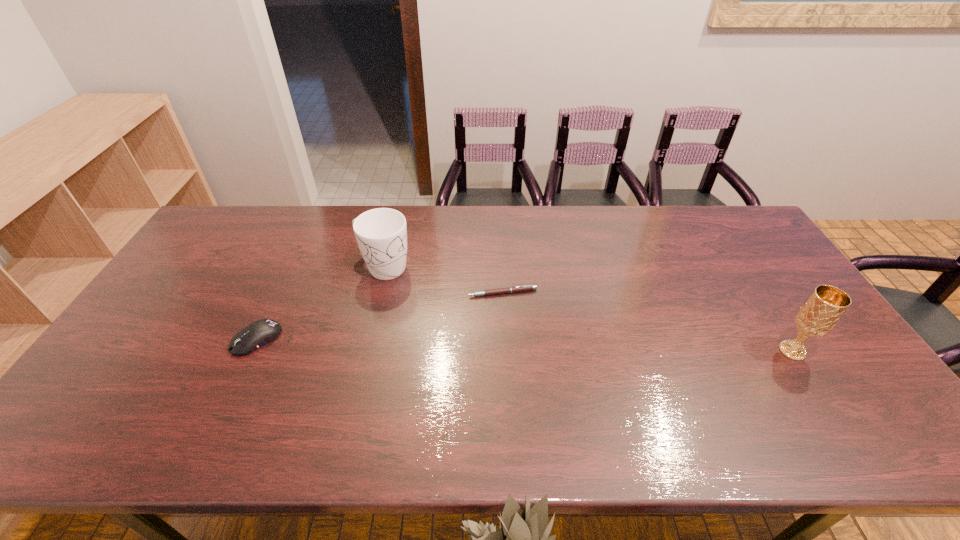
Identify the location of vacant area that lies between the chalice and the computer equipment. (524, 345).

Identify the location of object that is the closest to the second object from right to left. [381, 234].

Image resolution: width=960 pixels, height=540 pixels. I want to click on object that is the closest one to the third object from left to right, so click(381, 234).

Locate an element on the screen. free spot that satisfies the following two spatial constraints: 1. on the front side of the second object from right to left; 2. on the left side of the third object from right to left is located at coordinates (377, 293).

At what (x,y) coordinates should I click in order to perform the action: click on free spot that satisfies the following two spatial constraints: 1. on the front side of the farthest object; 2. on the right side of the rightmost object. Please return your answer as a coordinate pair (x, y). Looking at the image, I should click on (364, 351).

Locate an element on the screen. Image resolution: width=960 pixels, height=540 pixels. vacant space that satisfies the following two spatial constraints: 1. on the front side of the third object from left to right; 2. on the left side of the rightmost object is located at coordinates (505, 351).